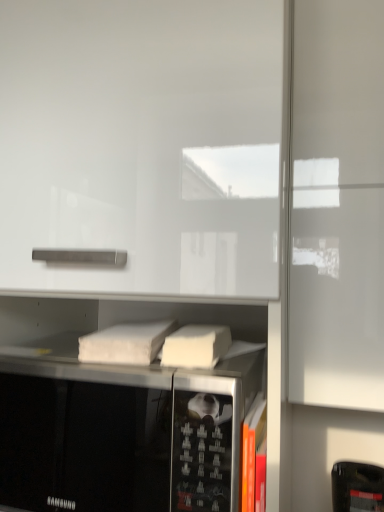
Question: Is white matte book at center, the second book from the bottom, oriented away from orange matte book at lower right, which ranks as the first book in right-to-left order?

Choices:
 (A) yes
 (B) no

Answer: (B)

Question: From a real-world perspective, is white matte book at center, the second book from the front, beneath orange matte book at lower right, the first book in the bottom-to-top sequence?

Choices:
 (A) yes
 (B) no

Answer: (B)

Question: Is white matte book at center, arranged as the 1th book when viewed from the top, not inside orange matte book at lower right, which ranks as the first book in right-to-left order?

Choices:
 (A) no
 (B) yes

Answer: (B)

Question: Considering the relative sizes of white matte book at center, the second book from the front, and orange matte book at lower right, which ranks as the first book in right-to-left order, in the image provided, is white matte book at center, the second book from the front, bigger than orange matte book at lower right, which ranks as the first book in right-to-left order,?

Choices:
 (A) no
 (B) yes

Answer: (B)

Question: Is the position of white matte book at center, the second book from the front, more distant than that of orange matte book at lower right, placed as the 2th book when sorted from top to bottom?

Choices:
 (A) no
 (B) yes

Answer: (B)

Question: From the image's perspective, is orange matte book at lower right, placed as the 2th book when sorted from top to bottom, positioned above or below white matte book at center, which is counted as the 1th book, starting from the left?

Choices:
 (A) above
 (B) below

Answer: (B)

Question: Is orange matte book at lower right, which ranks as the second book in left-to-right order, taller or shorter than white matte book at center, which is the 2th book from right to left?

Choices:
 (A) short
 (B) tall

Answer: (B)

Question: Visually, is orange matte book at lower right, which is the 1th book from front to back, positioned to the left or to the right of white matte book at center, marked as the 1th book in a back-to-front arrangement?

Choices:
 (A) left
 (B) right

Answer: (B)

Question: Do you think orange matte book at lower right, which is the second book in back-to-front order, is within white matte book at center, arranged as the 1th book when viewed from the top, or outside of it?

Choices:
 (A) outside
 (B) inside

Answer: (A)

Question: Is black matte microwave oven at center in front of or behind white matte book at center, arranged as the 1th book when viewed from the top, in the image?

Choices:
 (A) behind
 (B) front

Answer: (B)

Question: Is black matte microwave oven at center wider or thinner than white matte book at center, which is counted as the 1th book, starting from the left?

Choices:
 (A) wide
 (B) thin

Answer: (A)

Question: Visually, is black matte microwave oven at center positioned to the left or to the right of white matte book at center, the second book from the bottom?

Choices:
 (A) left
 (B) right

Answer: (A)

Question: Does point (59, 481) appear closer or farther from the camera than point (119, 339)?

Choices:
 (A) farther
 (B) closer

Answer: (B)

Question: Do you think orange matte book at lower right, which ranks as the second book in left-to-right order, is within black matte microwave oven at center, or outside of it?

Choices:
 (A) outside
 (B) inside

Answer: (A)

Question: Considering the positions of orange matte book at lower right, which ranks as the second book in left-to-right order, and black matte microwave oven at center in the image, is orange matte book at lower right, which ranks as the second book in left-to-right order, bigger or smaller than black matte microwave oven at center?

Choices:
 (A) small
 (B) big

Answer: (A)